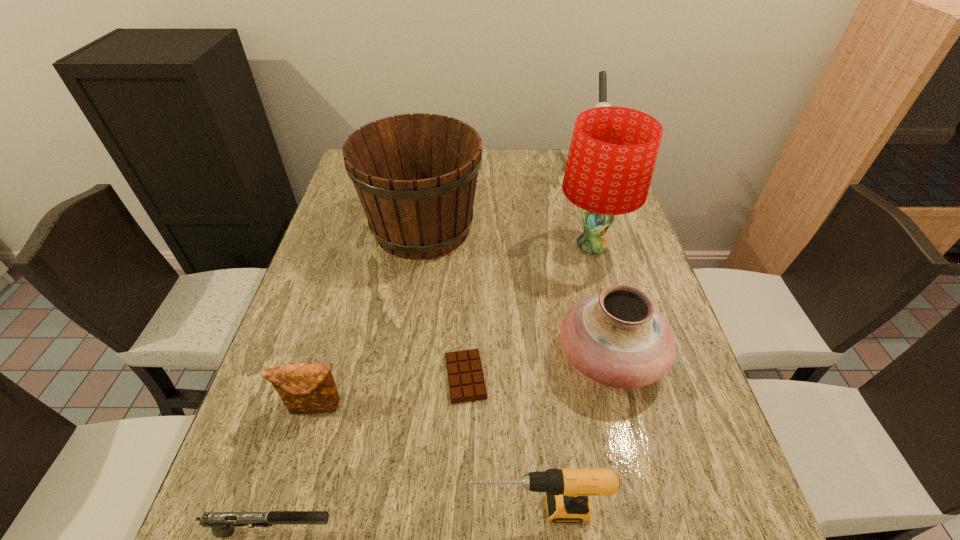
Where is `lampshade`? The width and height of the screenshot is (960, 540). lampshade is located at coordinates (613, 151).

Locate an element on the screen. This screenshot has height=540, width=960. microscope is located at coordinates (602, 74).

Identify the location of wine bucket. (415, 174).

Find the location of a particular element. The image size is (960, 540). the fourth tallest object is located at coordinates (616, 337).

This screenshot has height=540, width=960. I want to click on clutch bag, so click(x=305, y=388).

Locate an element on the screen. drill is located at coordinates (567, 490).

The image size is (960, 540). What are the coordinates of `the nearest object` in the screenshot? It's located at (222, 524).

Find the location of a particular element. The height and width of the screenshot is (540, 960). gun is located at coordinates (222, 524).

You are a GUI agent. You are given a task and a screenshot of the screen. Output one action in this format:
    pyautogui.click(x=<x>, y=<y>)
    Task: Click on the candy bar
    The image size is (960, 540).
    Given the screenshot: What is the action you would take?
    pyautogui.click(x=466, y=380)

Identify the location of free region located on the front-facing side of the tallest object. The image size is (960, 540). (525, 246).